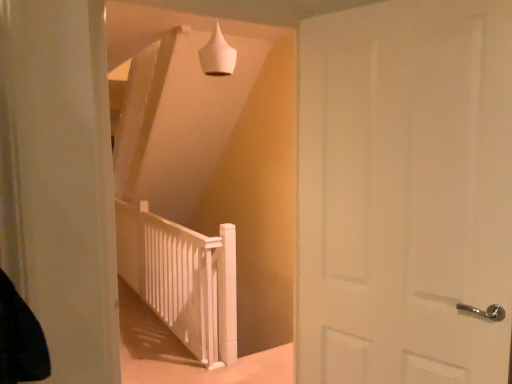
Describe the element at coordinates (217, 55) in the screenshot. I see `white matte cone at upper center` at that location.

I want to click on white matte cone at upper center, so click(x=217, y=55).

You are a GUI agent. You are given a task and a screenshot of the screen. Output one action in this format:
    pyautogui.click(x=<x>, y=<y>)
    Task: Click on the white matte cone at upper center
    This screenshot has width=512, height=384.
    Given the screenshot: What is the action you would take?
    (217, 55)

Is point (396, 302) closer to camera compared to point (203, 51)?

Yes, point (396, 302) is in front of point (203, 51).

Identify the location of lamp behind the white matte door at center. (217, 55).

Is white matte door at center further to camera compared to white matte cone at upper center?

That is False.

From the image's perspective, is white matte door at center beneath white matte cone at upper center?

Yes.

From the picture: Between white matte rail at center and white matte door at center, which one has larger size?

With larger size is white matte rail at center.

The height and width of the screenshot is (384, 512). I want to click on door above the white matte rail at center (from the image's perspective), so click(405, 193).

From a real-world perspective, does white matte rail at center stand above white matte door at center?

Incorrect, from a real-world perspective, white matte rail at center is lower than white matte door at center.

Is white matte door at center inside the boundaries of white matte rail at center, or outside?

white matte door at center exists outside the volume of white matte rail at center.

From a real-world perspective, is white matte door at center on top of white matte rail at center?

Indeed, from a real-world perspective, white matte door at center stands above white matte rail at center.

Is white matte door at center positioned in front of white matte rail at center?

Yes.

Considering the relative sizes of white matte door at center and white matte rail at center in the image provided, is white matte door at center taller than white matte rail at center?

Yes, white matte door at center is taller than white matte rail at center.

Identify the location of lamp above the white matte rail at center (from a real-world perspective). (217, 55).

From the image's perspective, between white matte cone at upper center and white matte rail at center, who is located below?

white matte rail at center appears lower in the image.

Is white matte cone at upper center not inside white matte rail at center?

That's correct, white matte cone at upper center is outside of white matte rail at center.

In the scene shown: Which object is more forward, white matte cone at upper center or white matte rail at center?

white matte cone at upper center is closer to the camera.

Relative to white matte cone at upper center, is white matte rail at center in front or behind?

Visually, white matte rail at center is located behind white matte cone at upper center.

From the image's perspective, is white matte rail at center above or below white matte cone at upper center?

Based on their image positions, white matte rail at center is located beneath white matte cone at upper center.

Can you tell me how much white matte rail at center and white matte cone at upper center differ in facing direction?

90.4 degrees.

How far apart are white matte cone at upper center and white matte door at center?

A distance of 4.79 feet exists between white matte cone at upper center and white matte door at center.

Considering the relative sizes of white matte cone at upper center and white matte door at center in the image provided, is white matte cone at upper center wider than white matte door at center?

Correct, the width of white matte cone at upper center exceeds that of white matte door at center.

Which is correct: white matte cone at upper center is inside white matte door at center, or outside of it?

white matte cone at upper center cannot be found inside white matte door at center.

Where is `door in front of the white matte cone at upper center`? The width and height of the screenshot is (512, 384). door in front of the white matte cone at upper center is located at coordinates (405, 193).

This screenshot has width=512, height=384. I want to click on rail located underneath the white matte door at center (from a real-world perspective), so click(x=182, y=279).

Estimate the real-world distances between objects in this image. Which object is closer to white matte door at center, white matte cone at upper center or white matte rail at center?

Among the two, white matte cone at upper center is located nearer to white matte door at center.

Looking at the image, which one is located closer to white matte door at center, white matte rail at center or white matte cone at upper center?

white matte cone at upper center is positioned closer to the anchor white matte door at center.

Considering their positions, is white matte door at center positioned further to white matte rail at center than white matte cone at upper center?

The object further to white matte rail at center is white matte door at center.

From the image, which object appears to be farther from white matte rail at center, white matte cone at upper center or white matte door at center?

white matte door at center.

From the image, which object appears to be farther from white matte cone at upper center, white matte door at center or white matte rail at center?

white matte rail at center is positioned further to the anchor white matte cone at upper center.

Estimate the real-world distances between objects in this image. Which object is closer to white matte cone at upper center, white matte rail at center or white matte door at center?

white matte door at center lies closer to white matte cone at upper center than the other object.

Where is `lamp between white matte door at center and white matte rail at center from front to back`? lamp between white matte door at center and white matte rail at center from front to back is located at coordinates (217, 55).